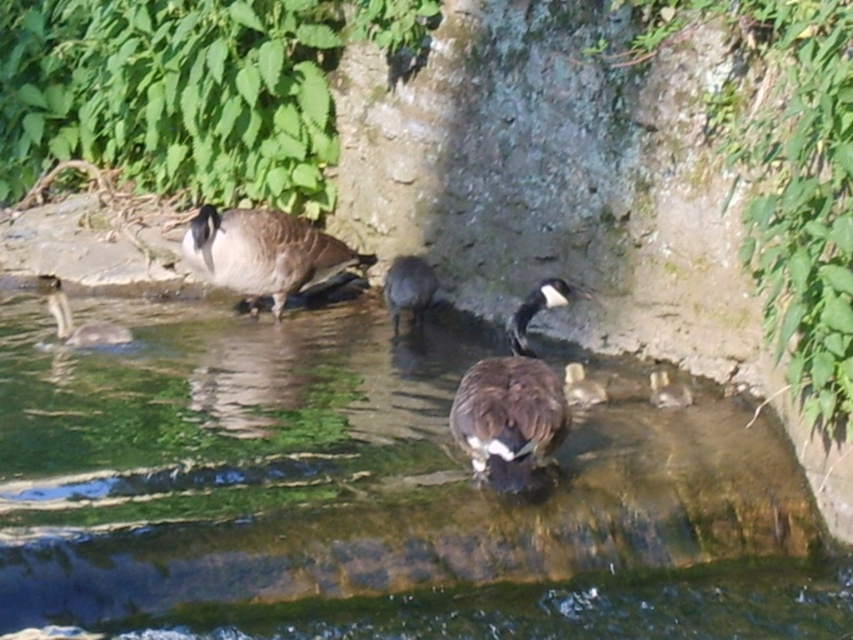
You are a photographer trying to capture a closeup of the clear water at center and the brown matte duck at center. Which object will appear larger in your photo?

The clear water at center will appear larger in the photo because it is closer to the viewer than the brown matte duck at center.

You are a photographer trying to capture a shot of the clear water at center and the brown matte duck at center. Based on their heights, which object would appear larger in your photo?

The clear water at center has a greater height compared to the brown matte duck at center, so it would appear larger in the photo.